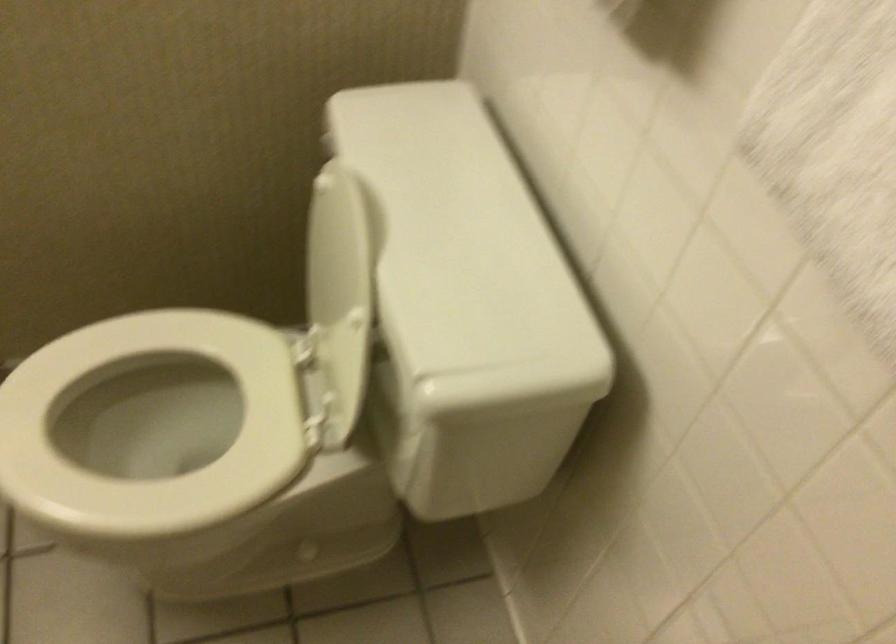
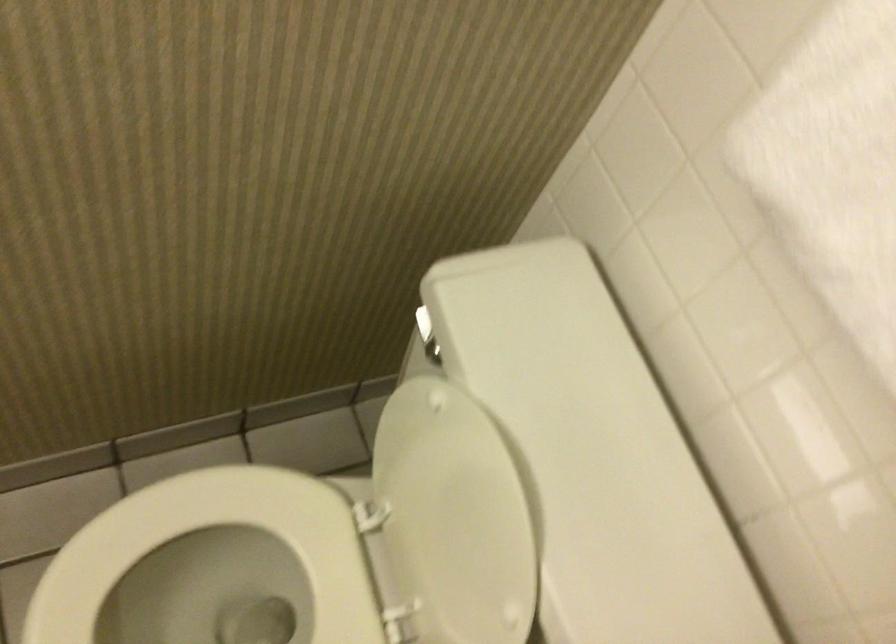
The point at (187, 450) is marked in the first image. Where is the corresponding point in the second image?

(222, 590)